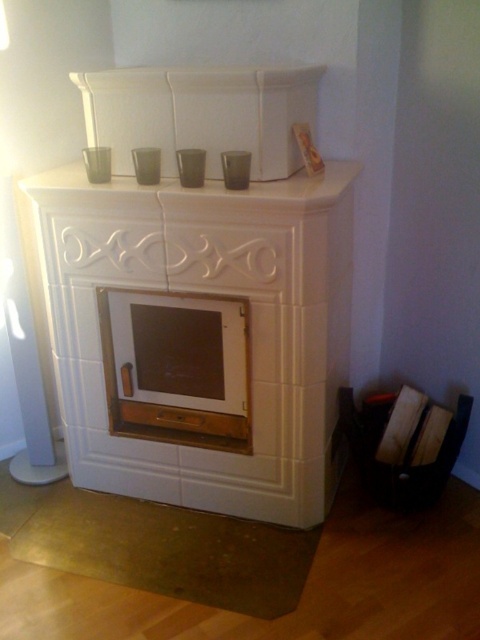
Between wooden fireplace at center and white glossy mantle at upper center, which one is positioned lower?

wooden fireplace at center is lower down.

Can you confirm if wooden fireplace at center is bigger than white glossy mantle at upper center?

No.

What do you see at coordinates (177, 368) in the screenshot? I see `wooden fireplace at center` at bounding box center [177, 368].

Identify the location of wooden fireplace at center. (177, 368).

Does point (133, 276) come behind point (317, 168)?

Yes, it is.

Can you confirm if white glossy fireplace at center is wider than wooden frame at upper center?

Indeed, white glossy fireplace at center has a greater width compared to wooden frame at upper center.

You are a GUI agent. You are given a task and a screenshot of the screen. Output one action in this format:
    pyautogui.click(x=<x>, y=<y>)
    Task: Click on the white glossy fireplace at center
    The image size is (480, 640).
    Given the screenshot: What is the action you would take?
    pyautogui.click(x=195, y=289)

Looking at this image, can you confirm if white glossy fireplace at center is taller than white glossy mantle at upper center?

Indeed, white glossy fireplace at center has a greater height compared to white glossy mantle at upper center.

Between point (314, 273) and point (192, 202), which one is positioned behind?

Point (314, 273)

The width and height of the screenshot is (480, 640). What are the coordinates of `white glossy fireplace at center` in the screenshot? It's located at (195, 289).